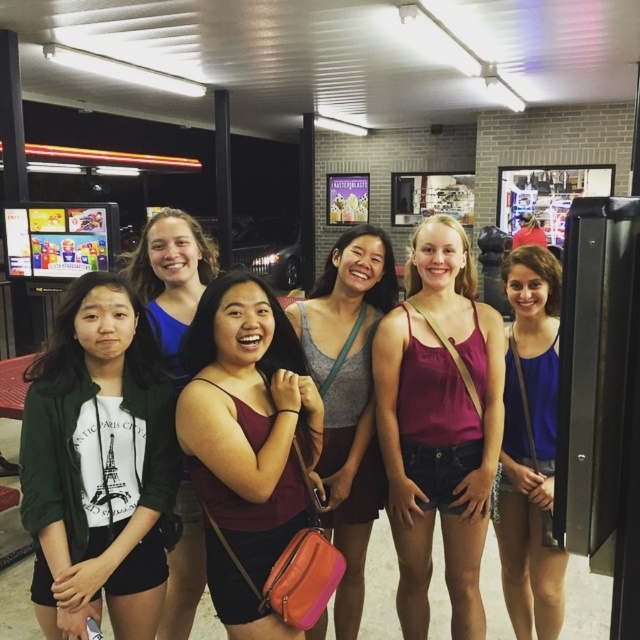
Question: Is matte red tank top at center bigger than matte gray tank top at center?

Choices:
 (A) no
 (B) yes

Answer: (A)

Question: Which point appears farthest from the camera in this image?

Choices:
 (A) (330, 481)
 (B) (547, 432)
 (C) (115, 593)

Answer: (B)

Question: Does dark green cotton jacket at left have a larger size compared to matte red tank top at center?

Choices:
 (A) no
 (B) yes

Answer: (B)

Question: Which is nearer to the blue satin tank top at center?

Choices:
 (A) matte gray tank top at center
 (B) matte pink tank top at center
 (C) white cotton shirt at left
 (D) matte red tank top at center

Answer: (B)

Question: Which object is positioned farthest from the dark green cotton jacket at left?

Choices:
 (A) matte red tank top at center
 (B) blue satin tank top at center
 (C) matte gray tank top at center
 (D) white cotton shirt at left

Answer: (B)

Question: Does matte pink tank top at center appear on the left side of blue satin tank top at center?

Choices:
 (A) yes
 (B) no

Answer: (A)